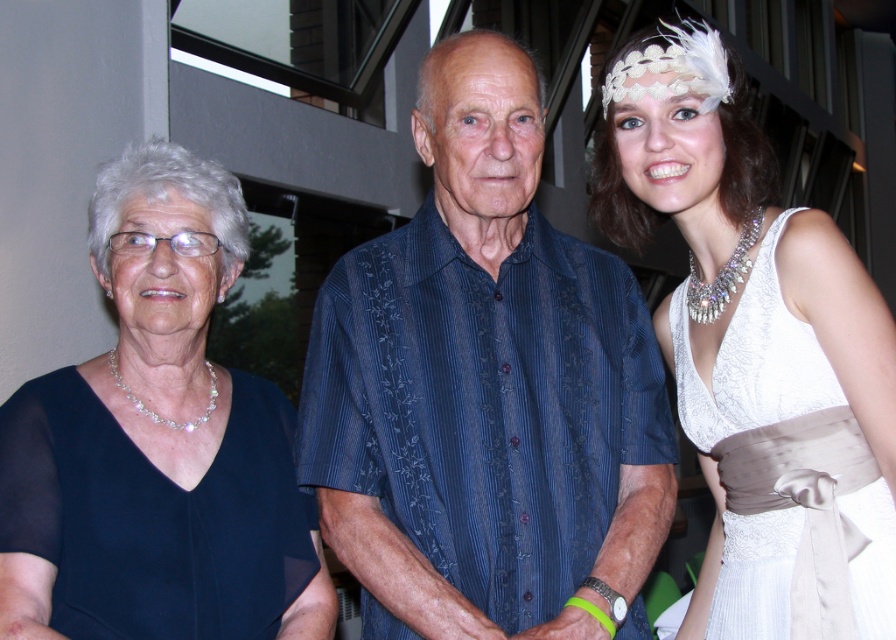
You are a photographer setting up for a group photo. You need to ensure there is at least 18 inches of space between the blue striped shirt at center and the white satin dress at right for proper lighting. Based on the current setup, is the distance sufficient?

The distance between the blue striped shirt at center and the white satin dress at right is 15.38 inches, which is less than the required 18 inches. Therefore, the current spacing is insufficient for proper lighting.

You are a photographer at a fashion show and need to capture both the matte black dress at left and the white satin dress at right in a single frame. Can you position yourself so that both dresses are fully visible without any overlap?

The matte black dress at left is positioned over the white satin dress at right, meaning they are layered with the matte black dress in front. To capture both fully without overlap, the photographer should adjust their angle to ensure neither dress blocks the other, possibly moving to the side where both are visible separately.

You are a photographer setting up for a group photo. You have two dresses in the scene, the matte black dress at left and the white satin dress at right. Which dress should you adjust to ensure they are the same height in the photo?

The matte black dress at left is taller than the white satin dress at right, so you should lower the matte black dress at left to match the height of the white satin dress at right.